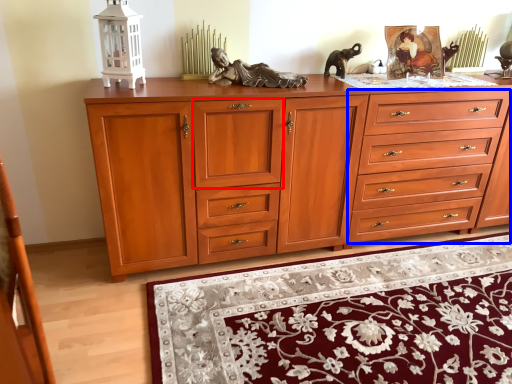
Question: Among these objects, which one is nearest to the camera, drawer (highlighted by a red box) or drawer (highlighted by a blue box)?

Choices:
 (A) drawer
 (B) drawer

Answer: (A)